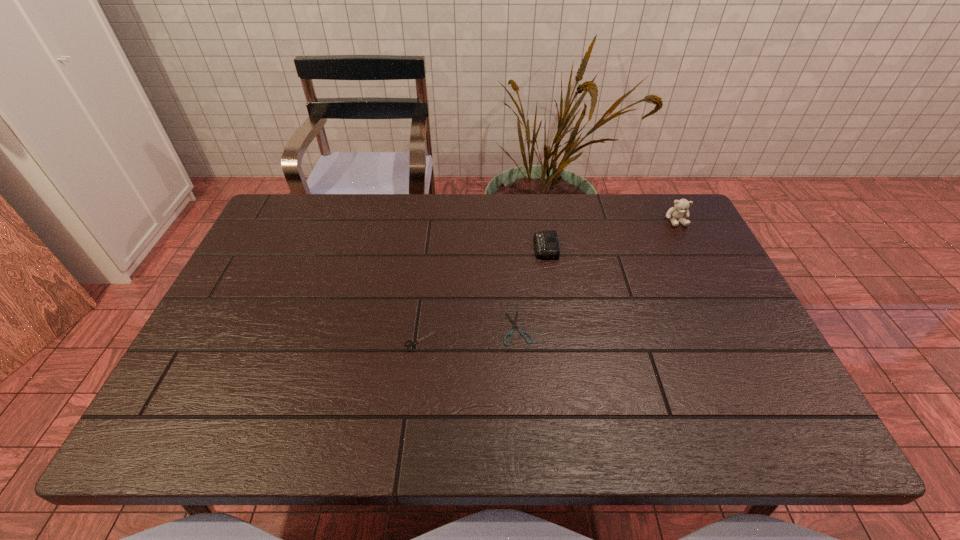
The height and width of the screenshot is (540, 960). I want to click on the farthest object, so click(x=681, y=206).

You are a GUI agent. You are given a task and a screenshot of the screen. Output one action in this format:
    pyautogui.click(x=<x>, y=<y>)
    Task: Click on the teddy bear
    The width and height of the screenshot is (960, 540).
    Given the screenshot: What is the action you would take?
    pyautogui.click(x=681, y=206)

This screenshot has width=960, height=540. I want to click on the third shortest object, so click(x=546, y=244).

Image resolution: width=960 pixels, height=540 pixels. What are the coordinates of `the third nearest object` in the screenshot? It's located at (546, 244).

This screenshot has width=960, height=540. I want to click on the left shears, so point(412,343).

What are the coordinates of `the leftmost object` in the screenshot? It's located at (412, 343).

The height and width of the screenshot is (540, 960). I want to click on the shorter shears, so click(x=514, y=322).

Where is `the right shears`? This screenshot has height=540, width=960. the right shears is located at coordinates point(514,322).

The image size is (960, 540). What are the coordinates of `free space located on the face of the rightmost object` in the screenshot? It's located at (716, 298).

The height and width of the screenshot is (540, 960). In order to click on vacant space situated 0.150m on the display of the alarm clock in this screenshot , I will do `click(484, 247)`.